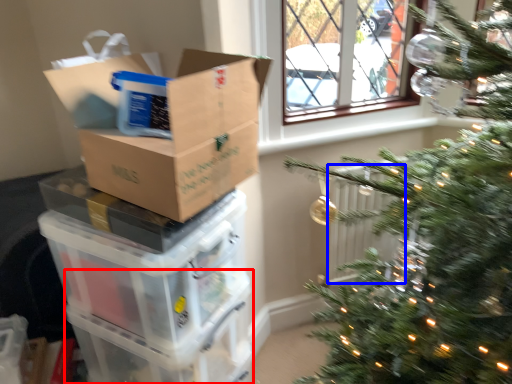
Question: Which object is further to the camera taking this photo, glass box (highlighted by a red box) or radiator (highlighted by a blue box)?

Choices:
 (A) glass box
 (B) radiator

Answer: (B)